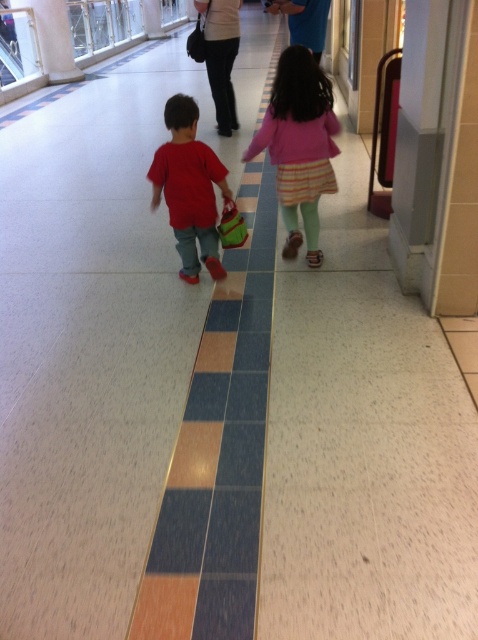
Question: Can you confirm if matte pink sweater at center is thinner than matte red shirt at center?

Choices:
 (A) yes
 (B) no

Answer: (B)

Question: Which point is closer to the camera taking this photo?

Choices:
 (A) (215, 241)
 (B) (335, 145)

Answer: (A)

Question: Considering the relative positions of matte pink sweater at center and matte red shirt at center in the image provided, where is matte pink sweater at center located with respect to matte red shirt at center?

Choices:
 (A) right
 (B) left

Answer: (A)

Question: Does matte pink sweater at center have a smaller size compared to matte red shirt at center?

Choices:
 (A) no
 (B) yes

Answer: (A)